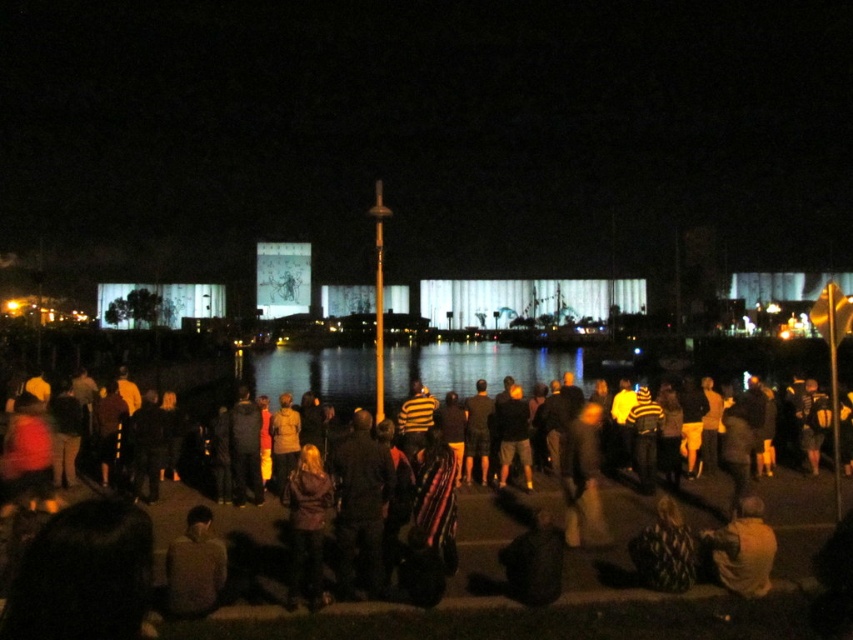
Is dark clothing crowd at center further to camera compared to transparent glass water at center?

That is False.

Who is taller, dark clothing crowd at center or transparent glass water at center?

dark clothing crowd at center is taller.

Does point (375, 630) lie behind point (466, 394)?

No, it is not.

You are a GUI agent. You are given a task and a screenshot of the screen. Output one action in this format:
    pyautogui.click(x=<x>, y=<y>)
    Task: Click on the dark clothing crowd at center
    This screenshot has height=640, width=853.
    Given the screenshot: What is the action you would take?
    pyautogui.click(x=503, y=573)